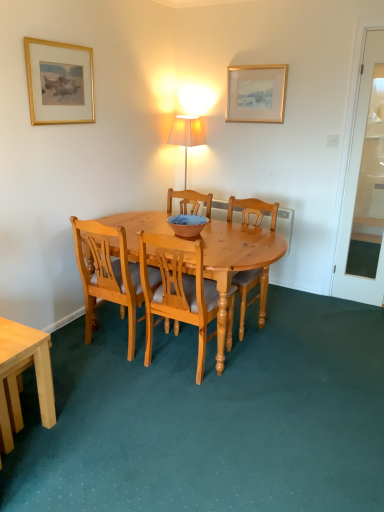
Locate an element on the screen. This screenshot has height=512, width=384. free space to the right of light brown wooden chair at center, positioned as the 1th chair in right-to-left order is located at coordinates (295, 320).